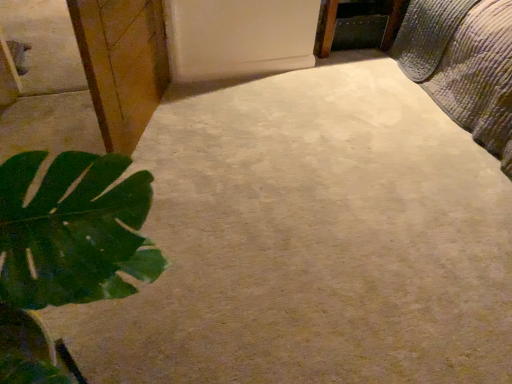
Question: Does textured quilted bed at upper right have a greater height compared to wooden cabinet at left?

Choices:
 (A) yes
 (B) no

Answer: (B)

Question: Is textured quilted bed at upper right turned away from wooden cabinet at left?

Choices:
 (A) yes
 (B) no

Answer: (B)

Question: Is textured quilted bed at upper right positioned before wooden cabinet at left?

Choices:
 (A) yes
 (B) no

Answer: (B)

Question: Can you confirm if textured quilted bed at upper right is bigger than wooden cabinet at left?

Choices:
 (A) yes
 (B) no

Answer: (A)

Question: Is textured quilted bed at upper right shorter than wooden cabinet at left?

Choices:
 (A) no
 (B) yes

Answer: (B)

Question: From the image's perspective, is wooden cabinet at left located above or below textured quilted bed at upper right?

Choices:
 (A) below
 (B) above

Answer: (A)

Question: Is point (112, 34) closer or farther from the camera than point (488, 41)?

Choices:
 (A) closer
 (B) farther

Answer: (A)

Question: Looking at their shapes, would you say wooden cabinet at left is wider or thinner than textured quilted bed at upper right?

Choices:
 (A) wide
 (B) thin

Answer: (B)

Question: Would you say wooden cabinet at left is inside or outside textured quilted bed at upper right?

Choices:
 (A) inside
 (B) outside

Answer: (B)

Question: Looking at their shapes, would you say wooden frame at upper right is wider or thinner than wooden cabinet at left?

Choices:
 (A) thin
 (B) wide

Answer: (B)

Question: In the image, is wooden frame at upper right positioned in front of or behind wooden cabinet at left?

Choices:
 (A) behind
 (B) front

Answer: (A)

Question: From a real-world perspective, is wooden frame at upper right positioned above or below wooden cabinet at left?

Choices:
 (A) below
 (B) above

Answer: (A)

Question: Looking at the image, does wooden frame at upper right seem bigger or smaller compared to wooden cabinet at left?

Choices:
 (A) small
 (B) big

Answer: (A)

Question: Do you think wooden cabinet at left is within wooden frame at upper right, or outside of it?

Choices:
 (A) inside
 (B) outside

Answer: (B)

Question: Considering the positions of wooden cabinet at left and wooden frame at upper right in the image, is wooden cabinet at left bigger or smaller than wooden frame at upper right?

Choices:
 (A) small
 (B) big

Answer: (B)